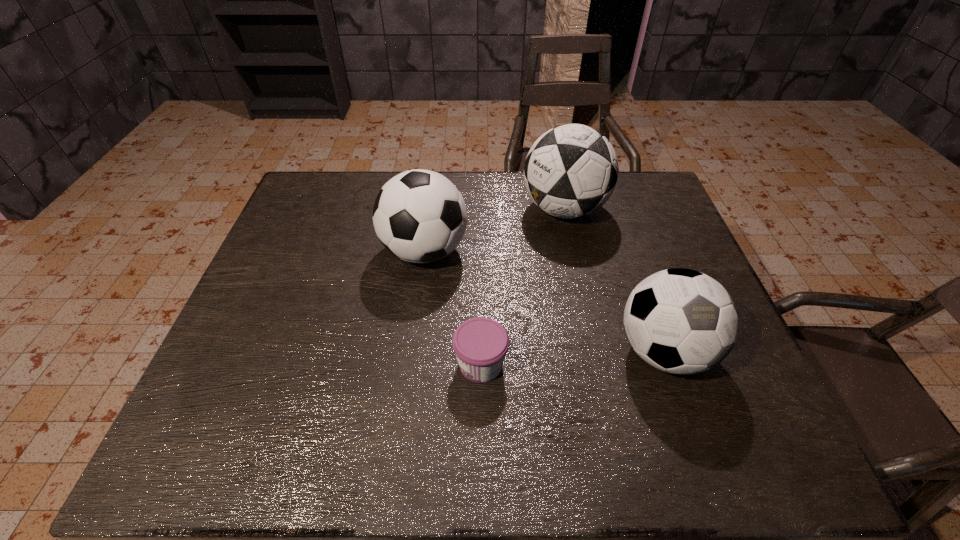
I want to click on vacant space that's between the leftmost soccer ball and the nearest soccer ball, so click(544, 301).

The height and width of the screenshot is (540, 960). Find the location of `free space that is in between the leftmost soccer ball and the nearest soccer ball`. free space that is in between the leftmost soccer ball and the nearest soccer ball is located at coordinates (544, 301).

Find the location of `vacant space that's between the nearest soccer ball and the leftmost soccer ball`. vacant space that's between the nearest soccer ball and the leftmost soccer ball is located at coordinates (544, 301).

The image size is (960, 540). In order to click on the second closest object to the leftmost soccer ball in this screenshot , I will do `click(480, 344)`.

Point out which object is positioned as the third nearest to the nearest soccer ball. Please provide its 2D coordinates. Your answer should be formatted as a tuple, i.e. [(x, y)], where the tuple contains the x and y coordinates of a point satisfying the conditions above.

[(420, 216)]

The width and height of the screenshot is (960, 540). Find the location of `soccer ball object that ranks as the third closest to the shortest object`. soccer ball object that ranks as the third closest to the shortest object is located at coordinates (570, 171).

The height and width of the screenshot is (540, 960). I want to click on the third closest soccer ball to the shortest object, so click(x=570, y=171).